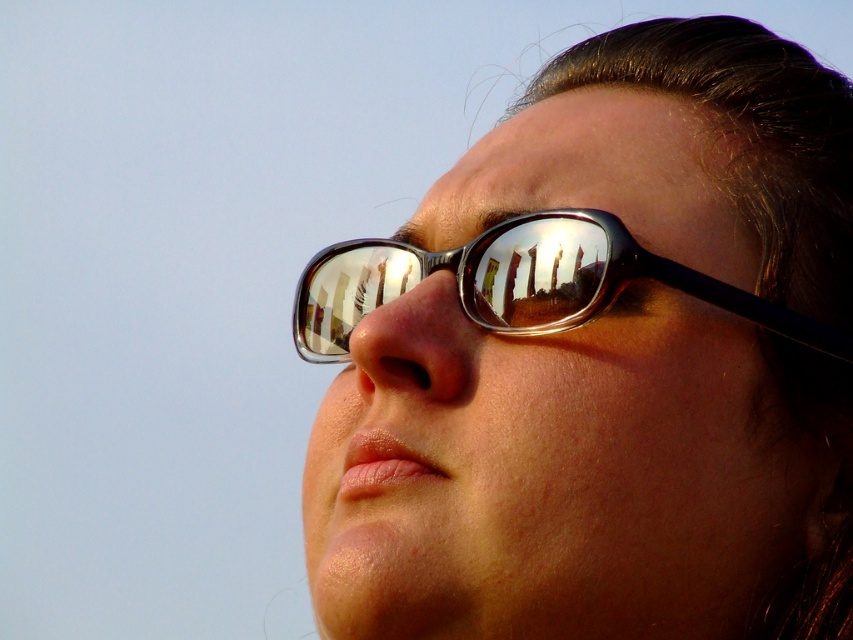
Question: Which of the following is the farthest from the observer?

Choices:
 (A) metallic reflective glasses at upper right
 (B) metallic reflective glasses at center

Answer: (B)

Question: Is metallic reflective glasses at upper right below metallic reflective glasses at center?

Choices:
 (A) no
 (B) yes

Answer: (A)

Question: Can you confirm if metallic reflective glasses at upper right is bigger than metallic reflective glasses at center?

Choices:
 (A) yes
 (B) no

Answer: (A)

Question: Is metallic reflective glasses at upper right thinner than metallic reflective glasses at center?

Choices:
 (A) no
 (B) yes

Answer: (A)

Question: Which point appears farthest from the camera in this image?

Choices:
 (A) (325, 307)
 (B) (793, 529)

Answer: (A)